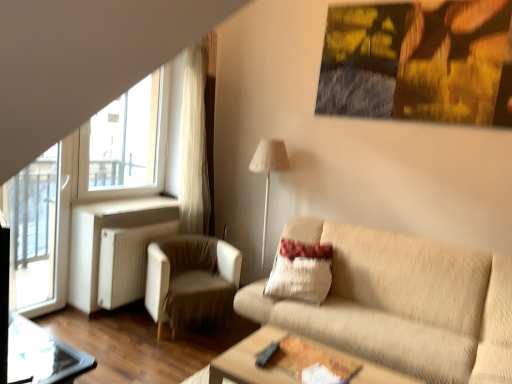
Question: Should I look upward or downward to see white fabric lampshade at center?

Choices:
 (A) up
 (B) down

Answer: (B)

Question: Can you confirm if wooden table at lower center is wider than beige textured pillow at center?

Choices:
 (A) yes
 (B) no

Answer: (A)

Question: Would you say wooden table at lower center is outside beige textured pillow at center?

Choices:
 (A) no
 (B) yes

Answer: (B)

Question: Is the surface of wooden table at lower center in direct contact with beige textured pillow at center?

Choices:
 (A) no
 (B) yes

Answer: (A)

Question: Is wooden table at lower center thinner than beige textured pillow at center?

Choices:
 (A) no
 (B) yes

Answer: (A)

Question: Is wooden table at lower center positioned in front of beige textured pillow at center?

Choices:
 (A) no
 (B) yes

Answer: (B)

Question: Is wooden table at lower center to the right of beige textured pillow at center from the viewer's perspective?

Choices:
 (A) yes
 (B) no

Answer: (B)

Question: Does transparent glass table at lower left have a larger size compared to white fabric lampshade at center?

Choices:
 (A) yes
 (B) no

Answer: (B)

Question: From a real-world perspective, is transparent glass table at lower left over white fabric lampshade at center?

Choices:
 (A) yes
 (B) no

Answer: (B)

Question: Would you say transparent glass table at lower left contains white fabric lampshade at center?

Choices:
 (A) no
 (B) yes

Answer: (A)

Question: Does transparent glass table at lower left have a lesser height compared to white fabric lampshade at center?

Choices:
 (A) yes
 (B) no

Answer: (A)

Question: Is transparent glass table at lower left further to the viewer compared to white fabric lampshade at center?

Choices:
 (A) no
 (B) yes

Answer: (A)

Question: Would you say transparent glass table at lower left is outside white fabric lampshade at center?

Choices:
 (A) yes
 (B) no

Answer: (A)

Question: Considering the relative positions of white fabric armchair at left and beige textured pillow at center in the image provided, is white fabric armchair at left to the left of beige textured pillow at center from the viewer's perspective?

Choices:
 (A) no
 (B) yes

Answer: (B)